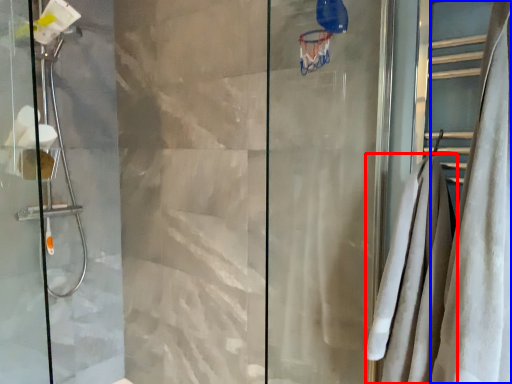
Question: Which point is closer to the camera, bath towel (highlighted by a red box) or shower curtain (highlighted by a blue box)?

Choices:
 (A) bath towel
 (B) shower curtain

Answer: (B)